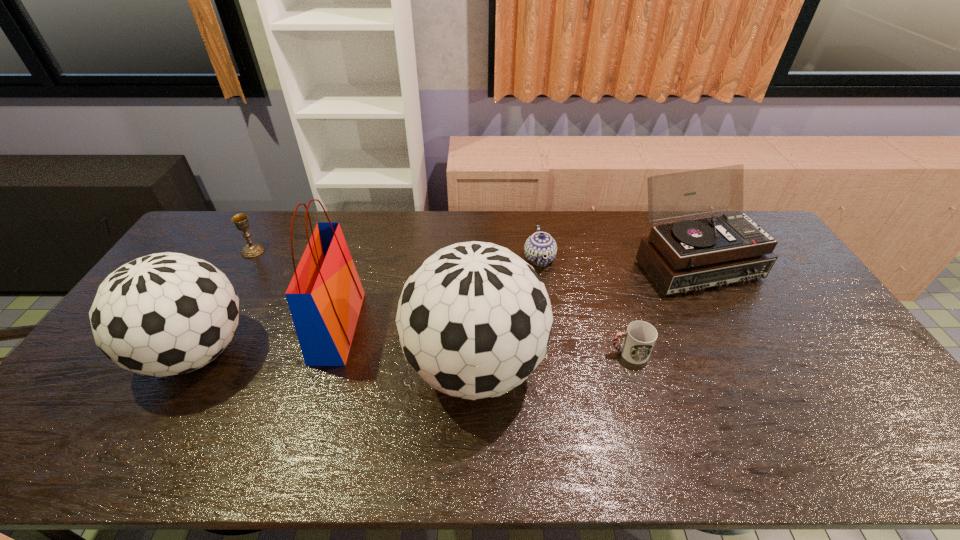
Image resolution: width=960 pixels, height=540 pixels. Identify the location of vacant space situated 0.170m on the left of the rightmost object. (586, 262).

Locate an element on the screen. The image size is (960, 540). free region located 0.090m at the spout of the chinaware is located at coordinates (497, 259).

Identify the location of free space located at the spout of the chinaware. (406, 259).

Where is `blank area located 0.380m at the spout of the chinaware`? The image size is (960, 540). blank area located 0.380m at the spout of the chinaware is located at coordinates (412, 259).

Where is `free region located 0.250m on the handle side of the fifth object from right to left`? This screenshot has width=960, height=540. free region located 0.250m on the handle side of the fifth object from right to left is located at coordinates (444, 327).

Image resolution: width=960 pixels, height=540 pixels. I want to click on vacant region located 0.210m on the right of the chalice, so click(324, 251).

I want to click on free point located on the handle side of the cup, so click(568, 353).

Image resolution: width=960 pixels, height=540 pixels. I want to click on free spot located on the handle side of the cup, so click(529, 353).

This screenshot has width=960, height=540. I want to click on free location located 0.320m on the handle side of the cup, so click(x=492, y=353).

Where is `record player located at the far edge`? This screenshot has width=960, height=540. record player located at the far edge is located at coordinates (x=689, y=255).